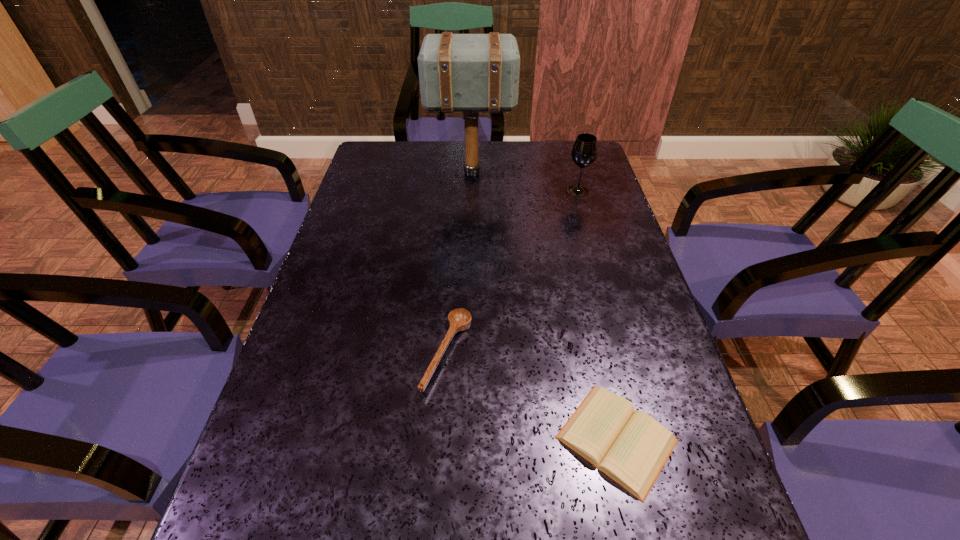
This screenshot has width=960, height=540. Find the location of `the tallest object`. the tallest object is located at coordinates (471, 73).

The height and width of the screenshot is (540, 960). What are the coordinates of `the second tallest object` in the screenshot? It's located at (584, 152).

This screenshot has height=540, width=960. I want to click on the third tallest object, so click(459, 319).

The height and width of the screenshot is (540, 960). I want to click on the shortest object, so click(631, 448).

Identify the location of free space located on the striking surface of the tallest object. The height and width of the screenshot is (540, 960). (556, 173).

Find the location of a particular element. Image resolution: width=960 pixels, height=540 pixels. vacant position located on the left of the third shortest object is located at coordinates (510, 191).

Where is `free space located on the right of the third tallest object`? The height and width of the screenshot is (540, 960). free space located on the right of the third tallest object is located at coordinates (641, 353).

Find the location of `vacant area located on the left of the shortest object`. vacant area located on the left of the shortest object is located at coordinates (372, 439).

Where is `object present at the far edge`? object present at the far edge is located at coordinates (471, 73).

This screenshot has width=960, height=540. What are the coordinates of `wineglass at the right edge` in the screenshot? It's located at (584, 152).